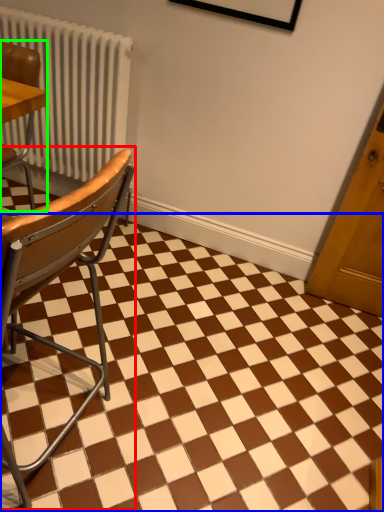
Question: Considering the real-world distances, which object is farthest from chair (highlighted by a red box)? square (highlighted by a blue box) or chair (highlighted by a green box)?

Choices:
 (A) square
 (B) chair

Answer: (B)